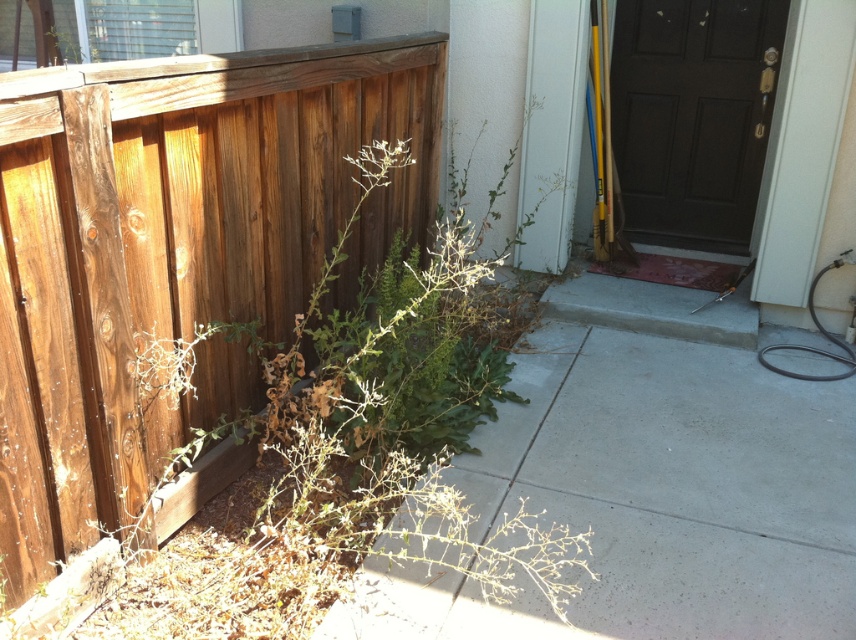
Question: Which point appears closest to the camera in this image?

Choices:
 (A) (632, 67)
 (B) (405, 611)
 (C) (146, 321)

Answer: (B)

Question: Which point is farther to the camera?

Choices:
 (A) gray concrete pavement at lower center
 (B) black rubber garden hose at lower right
 (C) weathered wood fence at left

Answer: (B)

Question: Which point is closer to the camera taking this photo?

Choices:
 (A) (593, 625)
 (B) (257, 193)

Answer: (A)

Question: Can you confirm if weathered wood fence at left is positioned to the left of dark wood door at center?

Choices:
 (A) no
 (B) yes

Answer: (B)

Question: Can you confirm if gray concrete pavement at lower center is thinner than black rubber garden hose at lower right?

Choices:
 (A) no
 (B) yes

Answer: (A)

Question: Is dark wood door at center to the left of black rubber garden hose at lower right from the viewer's perspective?

Choices:
 (A) no
 (B) yes

Answer: (B)